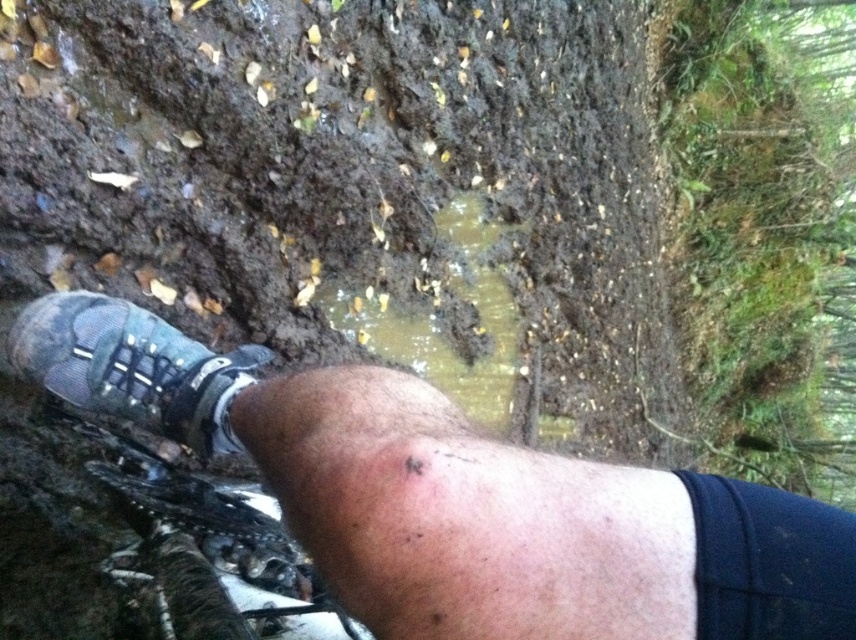
You are wearing two shoes, a textured gray shoe at lower left and a matte mesh shoe at lower left. Which one has a higher top?

The textured gray shoe at lower left is taller than the matte mesh shoe at lower left, so the textured gray shoe at lower left has a higher top.

You are hiking and see your two shoes on the muddy trail. Which shoe is positioned to the right when looking at the textured gray shoe at lower left and matte mesh shoe at lower left?

The textured gray shoe at lower left is positioned to the right of the matte mesh shoe at lower left.